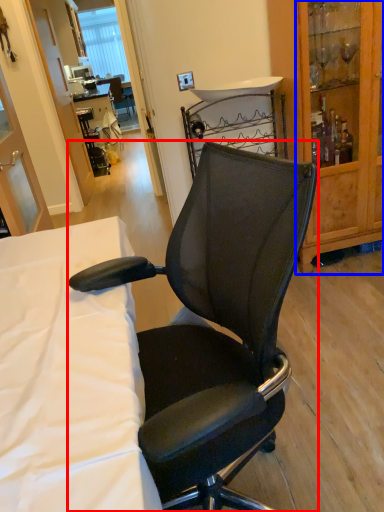
Question: Which of the following is the closest to the observer, chair (highlighted by a red box) or cabinetry (highlighted by a blue box)?

Choices:
 (A) chair
 (B) cabinetry

Answer: (A)